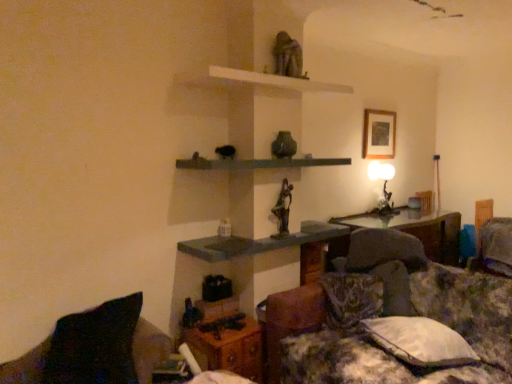
Question: Does wooden picture frame at upper center have a smaller size compared to white fabric pillow at lower right, the second pillow positioned from the front?

Choices:
 (A) yes
 (B) no

Answer: (A)

Question: Is wooden picture frame at upper center taller than white fabric pillow at lower right, the second pillow positioned from the front?

Choices:
 (A) yes
 (B) no

Answer: (A)

Question: Considering the relative positions of wooden picture frame at upper center and white fabric pillow at lower right, which ranks as the 2th pillow in back-to-front order, in the image provided, is wooden picture frame at upper center in front of white fabric pillow at lower right, which ranks as the 2th pillow in back-to-front order,?

Choices:
 (A) yes
 (B) no

Answer: (B)

Question: From a real-world perspective, does wooden picture frame at upper center sit lower than white fabric pillow at lower right, which is the 2th pillow in right-to-left order?

Choices:
 (A) yes
 (B) no

Answer: (B)

Question: Can you confirm if wooden picture frame at upper center is positioned to the left of white fabric pillow at lower right, the second pillow positioned from the front?

Choices:
 (A) no
 (B) yes

Answer: (A)

Question: Is point (386, 205) closer or farther from the camera than point (78, 316)?

Choices:
 (A) closer
 (B) farther

Answer: (B)

Question: Considering the positions of matte black table lamp at upper right and black fabric pillow at lower left, marked as the third pillow in a right-to-left arrangement, in the image, is matte black table lamp at upper right wider or thinner than black fabric pillow at lower left, marked as the third pillow in a right-to-left arrangement,?

Choices:
 (A) thin
 (B) wide

Answer: (A)

Question: Do you think matte black table lamp at upper right is within black fabric pillow at lower left, the 1th pillow positioned from the left, or outside of it?

Choices:
 (A) inside
 (B) outside

Answer: (B)

Question: From a real-world perspective, is matte black table lamp at upper right physically located above or below black fabric pillow at lower left, marked as the third pillow in a right-to-left arrangement?

Choices:
 (A) above
 (B) below

Answer: (A)

Question: Is wooden table at lower center, the second table viewed from the top, situated inside white fabric pillow at lower right, the second pillow from the left, or outside?

Choices:
 (A) outside
 (B) inside

Answer: (A)

Question: Considering the positions of point (226, 370) and point (464, 364), is point (226, 370) closer or farther from the camera than point (464, 364)?

Choices:
 (A) farther
 (B) closer

Answer: (A)

Question: Considering the positions of wooden table at lower center, which is the 1th table in left-to-right order, and white fabric pillow at lower right, the second pillow from the left, in the image, is wooden table at lower center, which is the 1th table in left-to-right order, wider or thinner than white fabric pillow at lower right, the second pillow from the left,?

Choices:
 (A) thin
 (B) wide

Answer: (A)

Question: From a real-world perspective, is wooden table at lower center, which is the 1th table in left-to-right order, positioned above or below white fabric pillow at lower right, which is the 2th pillow in right-to-left order?

Choices:
 (A) below
 (B) above

Answer: (A)

Question: Is point (481, 236) closer or farther from the camera than point (305, 162)?

Choices:
 (A) farther
 (B) closer

Answer: (A)

Question: In terms of width, does fluffy fabric pillow at lower right, the 3th pillow in the left-to-right sequence, look wider or thinner when compared to green concrete shelf at center, the second shelf when ordered from top to bottom?

Choices:
 (A) thin
 (B) wide

Answer: (A)